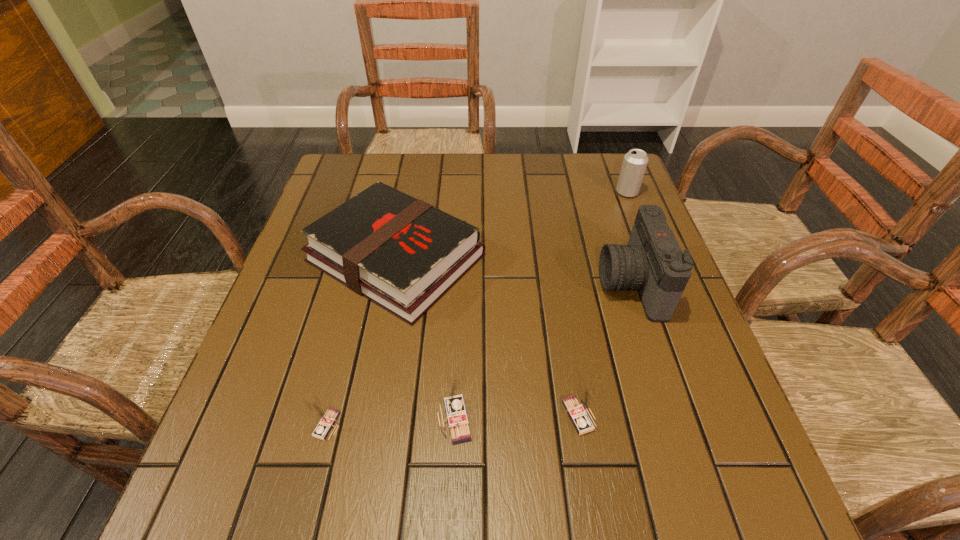
At what (x,y) coordinates should I click in order to perform the action: click on vacant region between the beer can and the hardback book. Please return your answer as a coordinate pair (x, y). The image size is (960, 540). Looking at the image, I should click on (512, 225).

Where is `vacant region between the hardback book and the shortest matchbox`? vacant region between the hardback book and the shortest matchbox is located at coordinates (362, 341).

Find the location of a particular element. The width and height of the screenshot is (960, 540). free space between the hardback book and the camera is located at coordinates (514, 271).

This screenshot has width=960, height=540. I want to click on empty location between the hardback book and the rightmost matchbox, so click(x=488, y=337).

At what (x,y) coordinates should I click in order to perform the action: click on blank region between the camera and the farthest object. Please return your answer as a coordinate pair (x, y). Image resolution: width=960 pixels, height=540 pixels. Looking at the image, I should click on (629, 238).

Locate an element on the screen. unoccupied position between the beer can and the camera is located at coordinates (629, 238).

Identify the location of the fourth closest object to the camera. The width and height of the screenshot is (960, 540). (453, 405).

You are a GUI agent. You are given a task and a screenshot of the screen. Output one action in this format:
    pyautogui.click(x=<x>, y=<y>)
    Task: Click on the closest object to the shortest matchbox
    
    Given the screenshot: What is the action you would take?
    (x=453, y=405)

The height and width of the screenshot is (540, 960). I want to click on matchbox that is the third closest to the camera, so [326, 417].

The width and height of the screenshot is (960, 540). What are the coordinates of `matchbox object that ranks as the second closest to the second matchbox from right to left` in the screenshot? It's located at (326, 417).